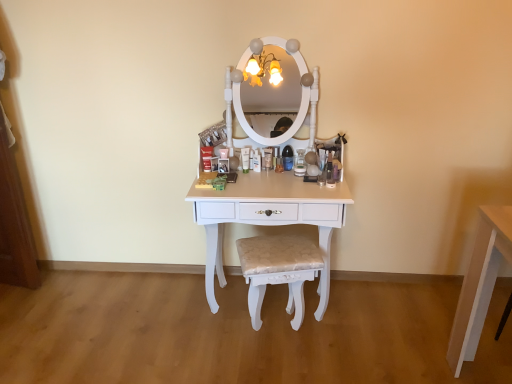
Find the location of `free region on the left part of white glossy table at center`. free region on the left part of white glossy table at center is located at coordinates (160, 320).